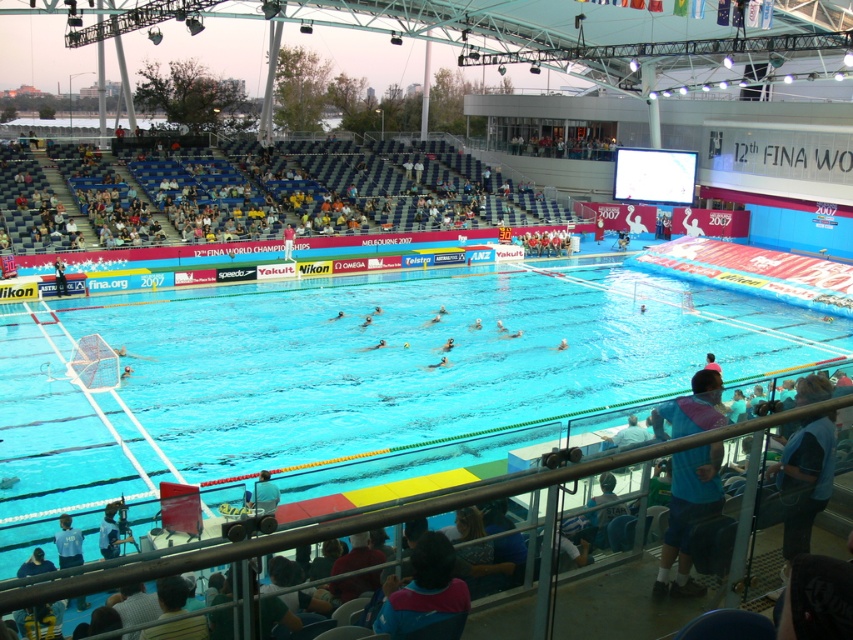
Which is in front, point (685, 506) or point (277, 500)?

Point (685, 506)

Image resolution: width=853 pixels, height=640 pixels. Find the location of `blue fabric shirt at lower right`. blue fabric shirt at lower right is located at coordinates (688, 515).

Between blue fabric shirt at lower right and blue fabric shirt at lower left, which one has more height?

With more height is blue fabric shirt at lower right.

Between point (672, 515) and point (123, 515), which one is positioned behind?

The point (123, 515) is more distant.

I want to click on blue fabric shirt at lower right, so click(688, 515).

Does blue fabric shirt at lower left have a lesser width compared to blue fabric at lower center?

No, blue fabric shirt at lower left is not thinner than blue fabric at lower center.

Does point (109, 556) come farther from viewer compared to point (262, 497)?

No, (109, 556) is closer to viewer.

Which is in front, point (99, 534) or point (268, 506)?

Point (268, 506) is more forward.

At what (x,y) coordinates should I click in order to perform the action: click on blue fabric shirt at lower left. Please return your answer as a coordinate pair (x, y). Looking at the image, I should click on (112, 531).